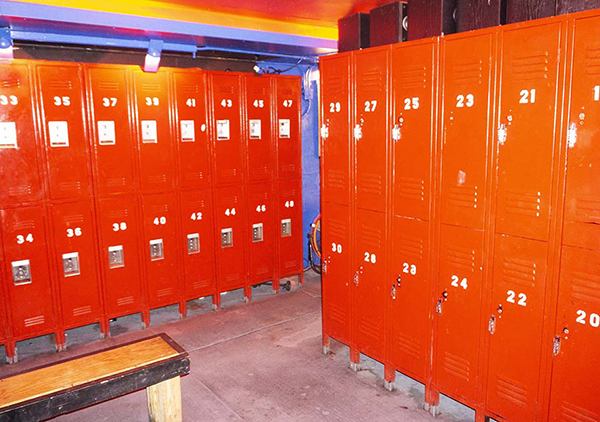
Where is `orange frame on electric floor fan`? Image resolution: width=600 pixels, height=422 pixels. orange frame on electric floor fan is located at coordinates (313, 240).